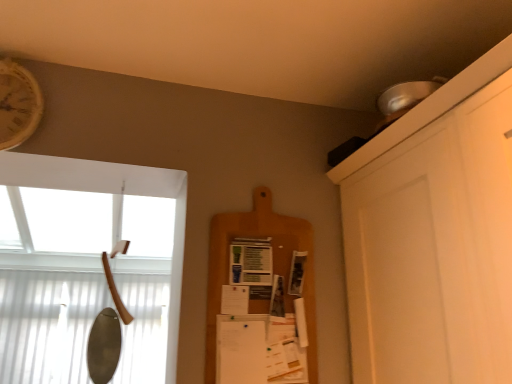
Question: Is wooden clock at upper left located within wooden axe handle at left?

Choices:
 (A) no
 (B) yes

Answer: (A)

Question: Considering the relative positions of wooden axe handle at left and wooden clock at upper left in the image provided, is wooden axe handle at left behind wooden clock at upper left?

Choices:
 (A) no
 (B) yes

Answer: (A)

Question: Is wooden axe handle at left bigger than wooden clock at upper left?

Choices:
 (A) no
 (B) yes

Answer: (B)

Question: Are wooden axe handle at left and wooden clock at upper left far apart?

Choices:
 (A) yes
 (B) no

Answer: (A)

Question: Considering the relative positions of wooden axe handle at left and wooden clock at upper left in the image provided, is wooden axe handle at left to the left of wooden clock at upper left from the viewer's perspective?

Choices:
 (A) no
 (B) yes

Answer: (A)

Question: Considering the relative positions of wooden axe handle at left and wooden clock at upper left in the image provided, is wooden axe handle at left in front of wooden clock at upper left?

Choices:
 (A) yes
 (B) no

Answer: (A)

Question: Does wooden clock at upper left have a greater height compared to wooden cutting board at center?

Choices:
 (A) yes
 (B) no

Answer: (B)

Question: From the image's perspective, does wooden clock at upper left appear higher than wooden cutting board at center?

Choices:
 (A) yes
 (B) no

Answer: (A)

Question: Does wooden clock at upper left have a lesser width compared to wooden cutting board at center?

Choices:
 (A) yes
 (B) no

Answer: (B)

Question: Is wooden clock at upper left closer to the viewer compared to wooden cutting board at center?

Choices:
 (A) yes
 (B) no

Answer: (A)

Question: Is wooden clock at upper left to the right of wooden cutting board at center from the viewer's perspective?

Choices:
 (A) no
 (B) yes

Answer: (A)

Question: Does wooden clock at upper left have a greater width compared to wooden cutting board at center?

Choices:
 (A) yes
 (B) no

Answer: (A)

Question: Is wooden clock at upper left to the right of wooden axe handle at left from the viewer's perspective?

Choices:
 (A) no
 (B) yes

Answer: (A)